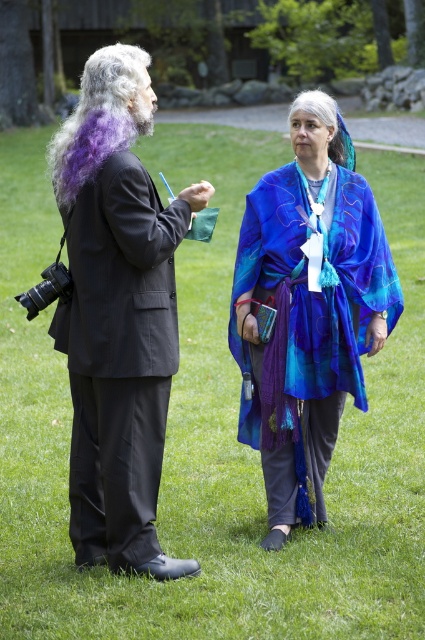
You are a photographer trying to capture a clear shot of the purple silky hair at left without the blue silk scarf at center blocking it. Based on their positions, can you adjust your angle to do so?

The purple silky hair at left is behind the blue silk scarf at center, so adjusting your angle to position yourself in front of the blue silk scarf at center might allow you to capture the purple silky hair at left without obstruction.